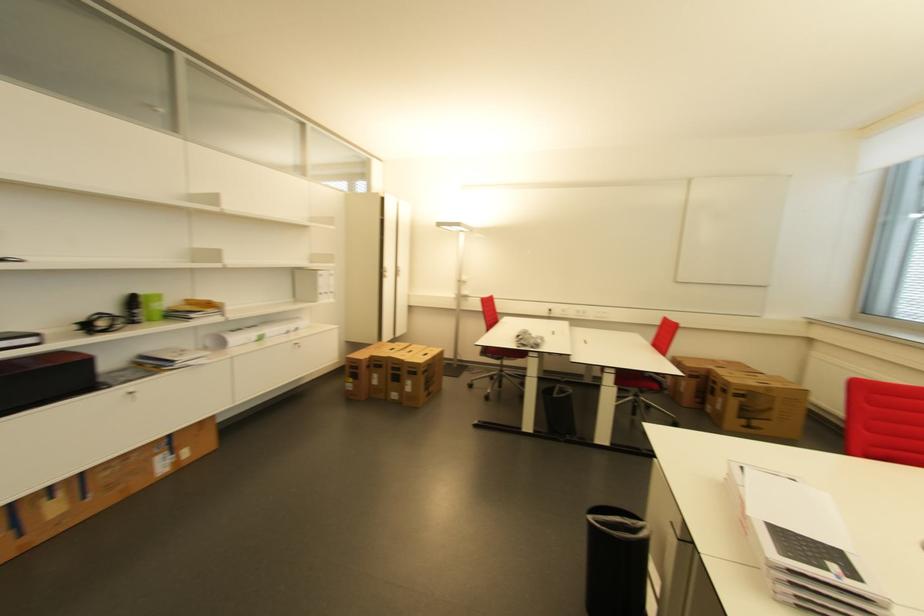
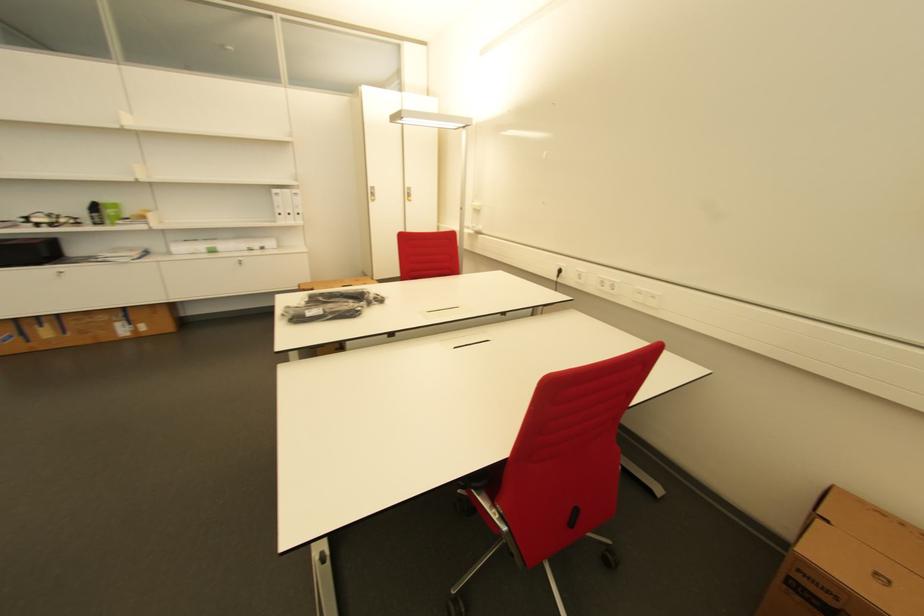
The point at (x=331, y=294) is marked in the first image. Where is the corresponding point in the second image?

(294, 216)